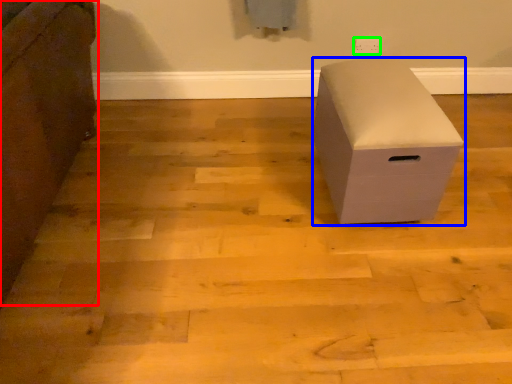
Question: Which is nearer to the furniture (highlighted by a red box)? furniture (highlighted by a blue box) or electric outlet (highlighted by a green box).

Choices:
 (A) furniture
 (B) electric outlet

Answer: (A)